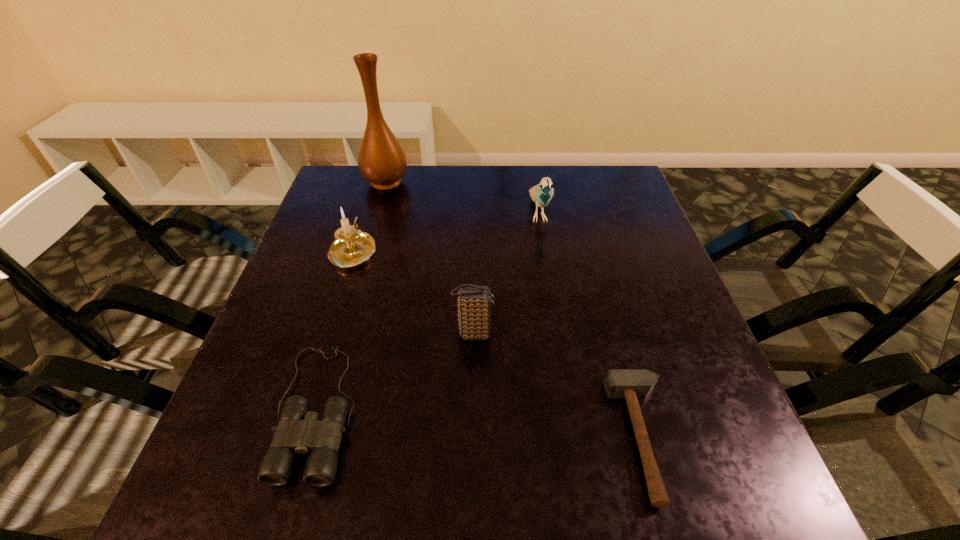
What are the coordinates of `free space between the clutch bag and the candle holder` in the screenshot? It's located at (414, 292).

This screenshot has height=540, width=960. Identify the location of blank region between the bird and the binoculars. (428, 311).

You are a GUI agent. You are given a task and a screenshot of the screen. Output one action in this format:
    pyautogui.click(x=<x>, y=<y>)
    Task: Click on the empty space that is in between the second object from right to left and the vase
    
    Given the screenshot: What is the action you would take?
    pyautogui.click(x=462, y=197)

The width and height of the screenshot is (960, 540). I want to click on vacant area between the vase and the hammer, so click(x=515, y=309).

The image size is (960, 540). In order to click on object identified as the fifth closest to the candle holder in this screenshot , I will do `click(630, 384)`.

Where is `object that ranks as the third closest to the candle holder`? object that ranks as the third closest to the candle holder is located at coordinates (474, 302).

You are a GUI agent. You are given a task and a screenshot of the screen. Output one action in this format:
    pyautogui.click(x=<x>, y=<y>)
    Task: Click on the free space that satisfies the following two spatial constraints: 1. with the zip open on the third object from right to left; 2. at the eyepiece of the binoculars
    The width and height of the screenshot is (960, 540).
    Given the screenshot: What is the action you would take?
    pyautogui.click(x=472, y=409)

Identify the location of vacant space that satisfies the following two spatial constraints: 1. on the handle side of the candle holder; 2. on the left side of the vase. The image size is (960, 540). (375, 181).